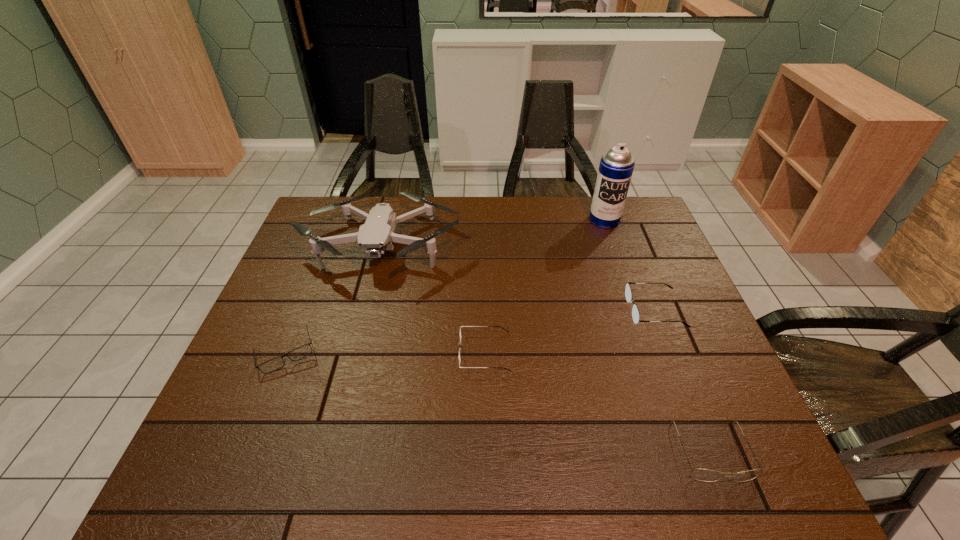
The height and width of the screenshot is (540, 960). Identify the location of free space that is in between the third farthest object and the nearest spectacles. (684, 381).

Image resolution: width=960 pixels, height=540 pixels. Find the location of `free space between the fifth shortest object and the nearest spectacles`. free space between the fifth shortest object and the nearest spectacles is located at coordinates (547, 348).

Locate an element on the screen. The width and height of the screenshot is (960, 540). empty location between the leftmost spectacles and the farthest spectacles is located at coordinates (470, 332).

Find the location of a particular element. This screenshot has width=960, height=540. vacant area that lies between the third object from left to right and the leftmost spectacles is located at coordinates (385, 353).

Where is `empty space that is in between the drone and the third object from left to right`? empty space that is in between the drone and the third object from left to right is located at coordinates [x=433, y=298].

The image size is (960, 540). I want to click on vacant area that lies between the fourth nearest object and the leftmost spectacles, so [x=470, y=332].

Find the location of a particular element. The image size is (960, 540). unoccupied area between the leftmost spectacles and the fifth shortest object is located at coordinates (334, 299).

I want to click on free point between the second spectacles from left to right and the fifth shortest object, so (x=433, y=298).

The height and width of the screenshot is (540, 960). What are the coordinates of `free space between the leftmost spectacles and the fifth shortest object` in the screenshot? It's located at (334, 299).

In order to click on free space between the tallest object and the farthest spectacles in this screenshot , I will do `click(630, 265)`.